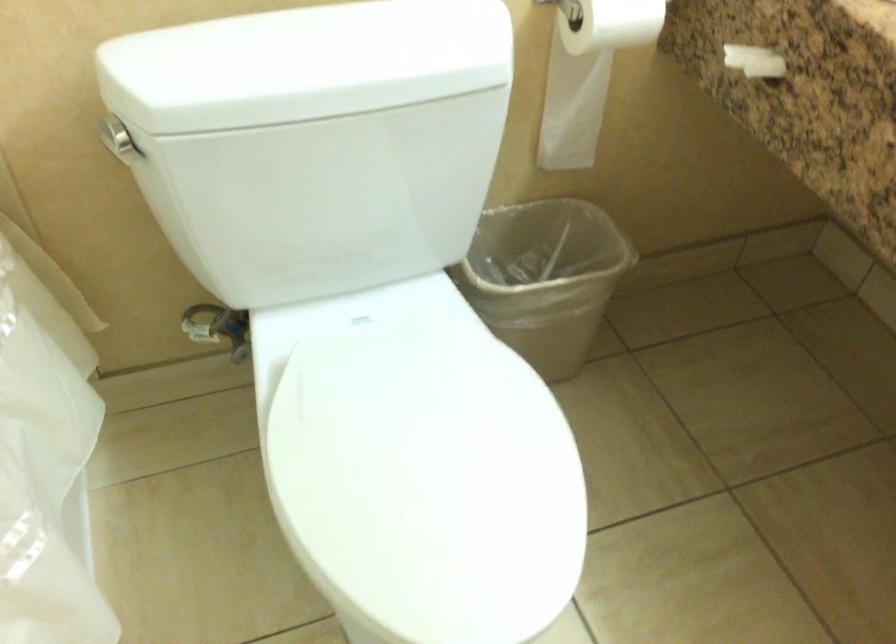
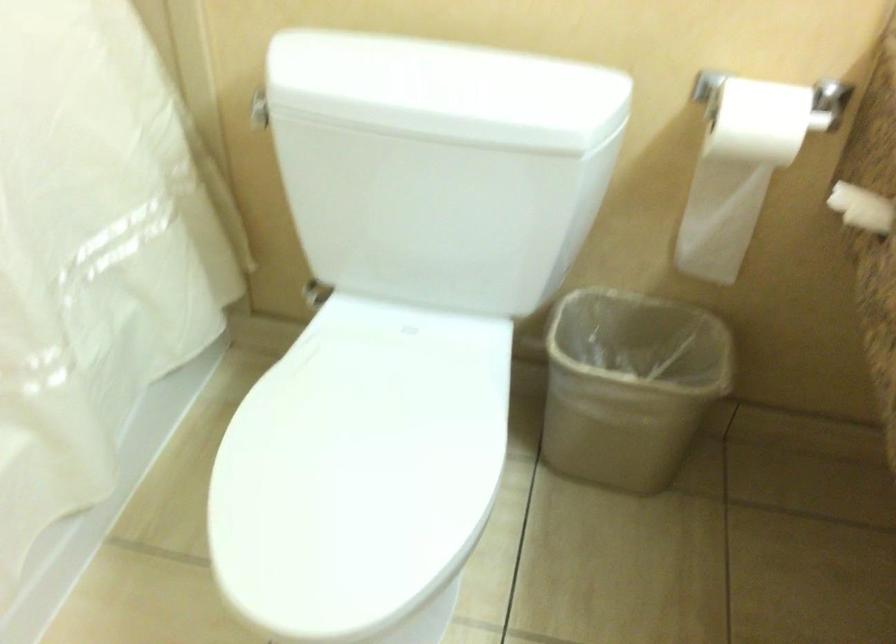
Where in the second image is the point corresponding to (560,288) from the first image?

(629, 384)